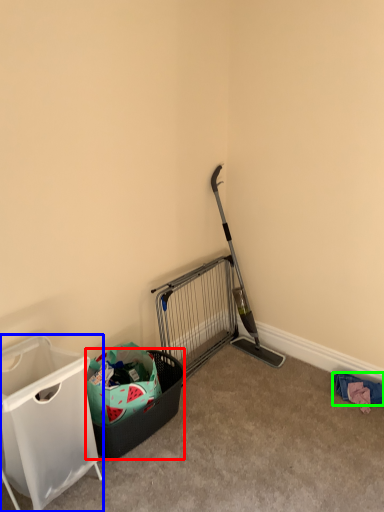
Question: Estimate the real-world distances between objects in this image. Which object is farther from shopping basket (highlighted by a red box), waste container (highlighted by a blue box) or clothing (highlighted by a green box)?

Choices:
 (A) waste container
 (B) clothing

Answer: (B)